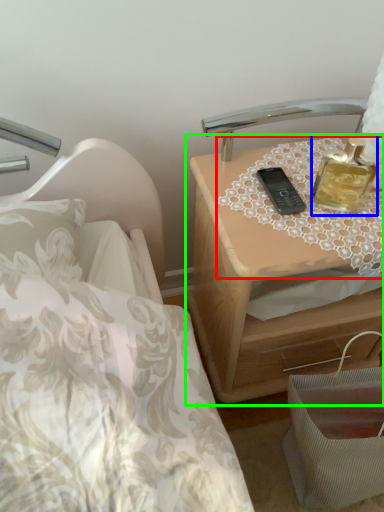
Question: Based on their relative distances, which object is nearer to tablecloth (highlighted by a red box)? Choose from perfume (highlighted by a blue box) and nightstand (highlighted by a green box).

Choices:
 (A) perfume
 (B) nightstand

Answer: (A)